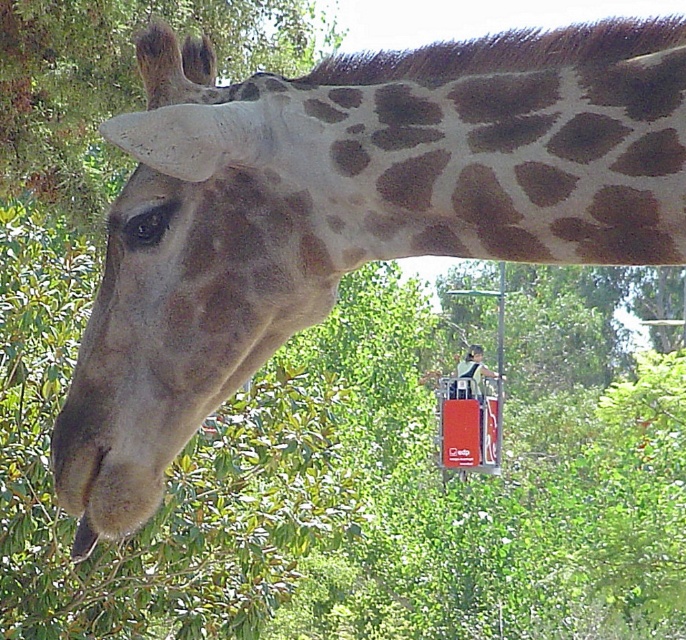
Which of these two, brown spotted skin at center or smooth brown head at center, stands taller?

Standing taller between the two is brown spotted skin at center.

Which is more to the left, brown spotted skin at center or smooth brown head at center?

Positioned to the left is brown spotted skin at center.

Find the location of a particular element. brown spotted skin at center is located at coordinates (512, 141).

I want to click on brown spotted skin at center, so click(512, 141).